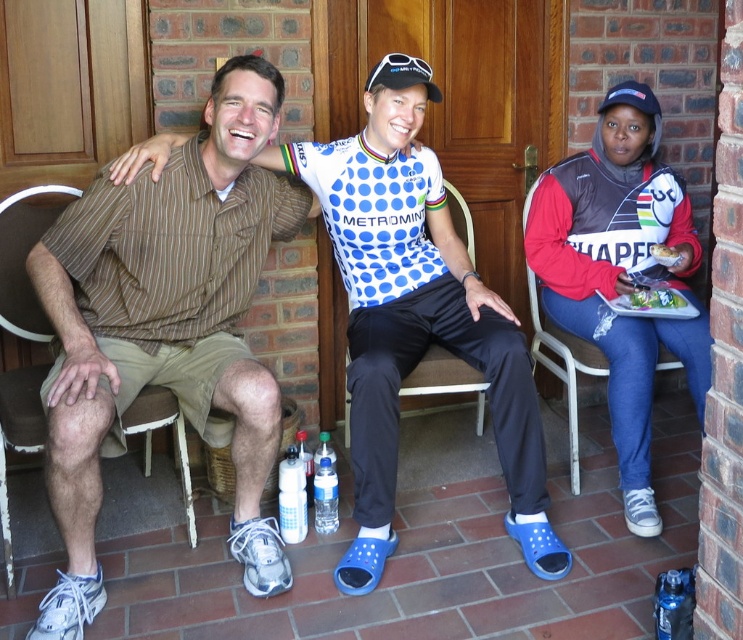
Question: Which point is closer to the camera?

Choices:
 (A) white paper plate at center
 (B) green leafy salad at right
 (C) metallic silver chair at center
 (D) brown wood chair at left

Answer: (D)

Question: Does metallic silver chair at center lie in front of white paper plate at center?

Choices:
 (A) no
 (B) yes

Answer: (B)

Question: Considering the relative positions of brown striped shirt at left and metallic silver chair at right in the image provided, where is brown striped shirt at left located with respect to metallic silver chair at right?

Choices:
 (A) right
 (B) left

Answer: (B)

Question: Based on their relative distances, which object is farther from the brown wood chair at left?

Choices:
 (A) brown striped shirt at left
 (B) green leafy salad at right
 (C) metallic silver chair at right
 (D) white paper plate at center

Answer: (D)

Question: Which point is closer to the camera?

Choices:
 (A) (1, 230)
 (B) (649, 307)

Answer: (A)

Question: Where is metallic silver chair at center located in relation to green leafy salad at right in the image?

Choices:
 (A) left
 (B) right

Answer: (A)